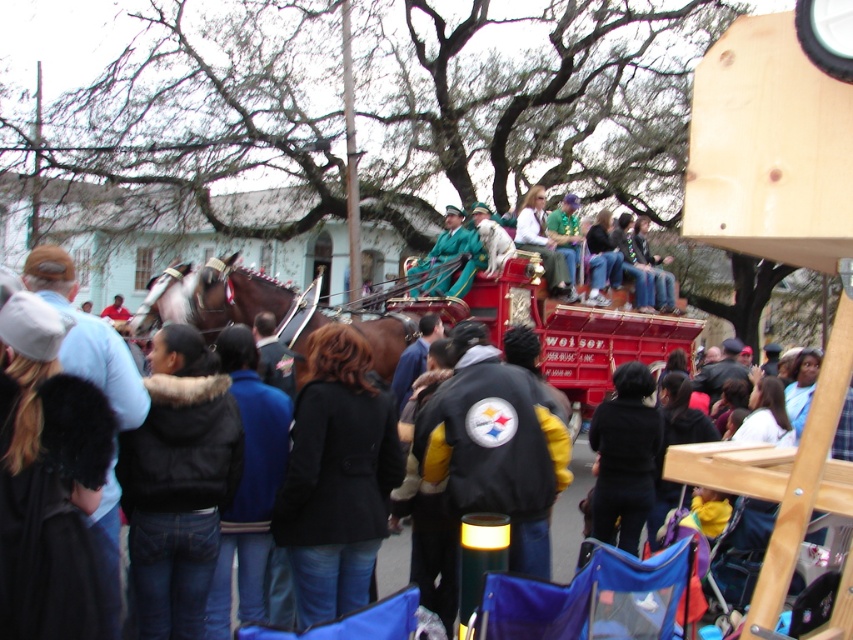
Consider the image. What is the 2D coordinate of the green velvet jacket at center?

The 2D coordinate of the green velvet jacket at center is at point [548,250].